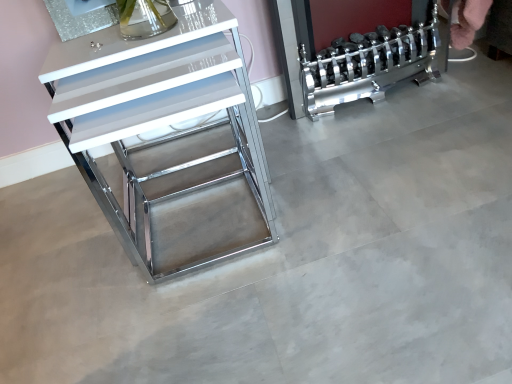
What do you see at coordinates (168, 139) in the screenshot? The image size is (512, 384). I see `white glossy drawer at left` at bounding box center [168, 139].

What are the coordinates of `white glossy drawer at left` in the screenshot? It's located at (168, 139).

Image resolution: width=512 pixels, height=384 pixels. What do you see at coordinates (368, 65) in the screenshot? I see `chrome metallic dumbbell rack at right` at bounding box center [368, 65].

Locate an element on the screen. chrome metallic dumbbell rack at right is located at coordinates (368, 65).

This screenshot has height=384, width=512. What are the coordinates of `white glossy drawer at left` in the screenshot? It's located at (168, 139).

Considering the relative positions of white glossy drawer at left and chrome metallic dumbbell rack at right in the image provided, is white glossy drawer at left to the left of chrome metallic dumbbell rack at right from the viewer's perspective?

Indeed, white glossy drawer at left is positioned on the left side of chrome metallic dumbbell rack at right.

Considering the positions of objects white glossy drawer at left and chrome metallic dumbbell rack at right in the image provided, who is behind, white glossy drawer at left or chrome metallic dumbbell rack at right?

chrome metallic dumbbell rack at right is further away from the camera.

Is point (188, 5) more distant than point (306, 107)?

No, (188, 5) is in front of (306, 107).

Looking at this image, from the image's perspective, is white glossy drawer at left located above or below chrome metallic dumbbell rack at right?

Based on their image positions, white glossy drawer at left is located beneath chrome metallic dumbbell rack at right.

From a real-world perspective, is white glossy drawer at left physically located above or below chrome metallic dumbbell rack at right?

white glossy drawer at left is above chrome metallic dumbbell rack at right.

Looking at this image, considering the sizes of white glossy drawer at left and chrome metallic dumbbell rack at right in the image, is white glossy drawer at left wider or thinner than chrome metallic dumbbell rack at right?

white glossy drawer at left is wider than chrome metallic dumbbell rack at right.

In terms of height, does white glossy drawer at left look taller or shorter compared to chrome metallic dumbbell rack at right?

white glossy drawer at left is taller than chrome metallic dumbbell rack at right.

Is white glossy drawer at left smaller than chrome metallic dumbbell rack at right?

Incorrect, white glossy drawer at left is not smaller in size than chrome metallic dumbbell rack at right.

Is white glossy drawer at left spatially inside chrome metallic dumbbell rack at right, or outside of it?

white glossy drawer at left is outside chrome metallic dumbbell rack at right.

Is white glossy drawer at left directly adjacent to chrome metallic dumbbell rack at right?

They are not placed beside each other.

Is white glossy drawer at left facing towards chrome metallic dumbbell rack at right?

No, white glossy drawer at left is not oriented towards chrome metallic dumbbell rack at right.

Locate an element on the screen. appliance that is above the white glossy drawer at left (from the image's perspective) is located at coordinates (368, 65).

Between chrome metallic dumbbell rack at right and white glossy drawer at left, which one appears on the right side from the viewer's perspective?

chrome metallic dumbbell rack at right is more to the right.

Which is in front, chrome metallic dumbbell rack at right or white glossy drawer at left?

white glossy drawer at left is more forward.

Between point (432, 7) and point (208, 25), which one is positioned in front?

The point (208, 25) is closer to the camera.

From the image's perspective, is chrome metallic dumbbell rack at right located above or below white glossy drawer at left?

Based on their image positions, chrome metallic dumbbell rack at right is located above white glossy drawer at left.

From a real-world perspective, between chrome metallic dumbbell rack at right and white glossy drawer at left, who is vertically lower?

chrome metallic dumbbell rack at right.

Is chrome metallic dumbbell rack at right wider than white glossy drawer at left?

Incorrect, the width of chrome metallic dumbbell rack at right does not surpass that of white glossy drawer at left.

Based on the photo, in terms of height, does chrome metallic dumbbell rack at right look taller or shorter compared to white glossy drawer at left?

chrome metallic dumbbell rack at right is shorter than white glossy drawer at left.

Looking at the image, does chrome metallic dumbbell rack at right seem bigger or smaller compared to white glossy drawer at left?

In the image, chrome metallic dumbbell rack at right appears to be smaller than white glossy drawer at left.

Can we say chrome metallic dumbbell rack at right lies outside white glossy drawer at left?

Yes, chrome metallic dumbbell rack at right is located beyond the bounds of white glossy drawer at left.

Would you say chrome metallic dumbbell rack at right is a long distance from white glossy drawer at left?

No, there isn't a large distance between chrome metallic dumbbell rack at right and white glossy drawer at left.

Could you tell me if chrome metallic dumbbell rack at right is facing white glossy drawer at left?

No, chrome metallic dumbbell rack at right is not turned towards white glossy drawer at left.

How many degrees apart are the facing directions of chrome metallic dumbbell rack at right and white glossy drawer at left?

The angular difference between chrome metallic dumbbell rack at right and white glossy drawer at left is 0.55 degrees.

From the picture: How distant is chrome metallic dumbbell rack at right from white glossy drawer at left?

chrome metallic dumbbell rack at right and white glossy drawer at left are 16.99 inches apart.

At what (x,y) coordinates should I click in order to perform the action: click on appliance that is behind the white glossy drawer at left. Please return your answer as a coordinate pair (x, y). The width and height of the screenshot is (512, 384). Looking at the image, I should click on (368, 65).

Identify the location of appliance below the white glossy drawer at left (from a real-world perspective). (368, 65).

Locate an element on the screen. appliance above the white glossy drawer at left (from the image's perspective) is located at coordinates (368, 65).